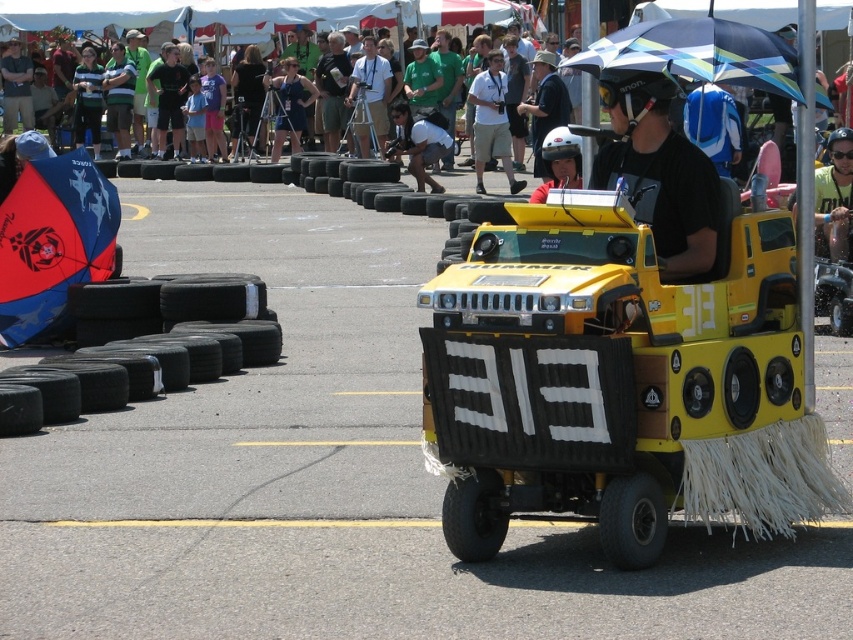
Between point (659, 387) and point (664, 104), which one is positioned behind?

Positioned behind is point (664, 104).

The width and height of the screenshot is (853, 640). What do you see at coordinates (618, 381) in the screenshot?
I see `yellow matte hummer at center` at bounding box center [618, 381].

Where is `yellow matte hummer at center`? This screenshot has width=853, height=640. yellow matte hummer at center is located at coordinates (618, 381).

Is yellow matte hummer at center shorter than blue and white striped umbrella at center?

No, yellow matte hummer at center is not shorter than blue and white striped umbrella at center.

Is point (792, 403) closer to viewer compared to point (595, 67)?

Yes, point (792, 403) is in front of point (595, 67).

Image resolution: width=853 pixels, height=640 pixels. I want to click on yellow matte hummer at center, so (618, 381).

Who is more forward, (100,262) or (553,152)?

Point (553,152) is more forward.

Which is more to the left, blue fabric umbrella at left or white matte helmet at center?

Positioned to the left is blue fabric umbrella at left.

In order to click on blue fabric umbrella at left in this screenshot , I will do `click(51, 241)`.

Where is `blue fabric umbrella at left`? blue fabric umbrella at left is located at coordinates (51, 241).